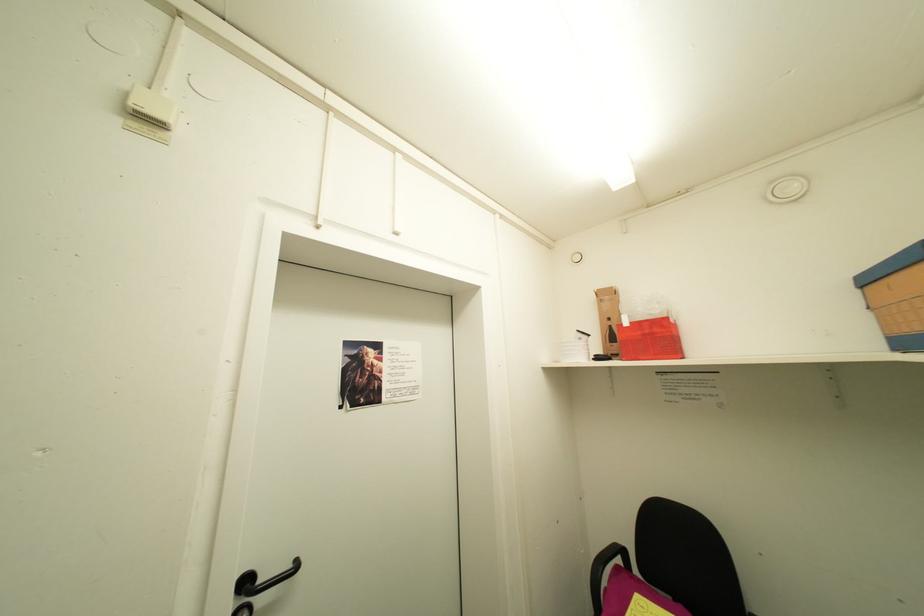
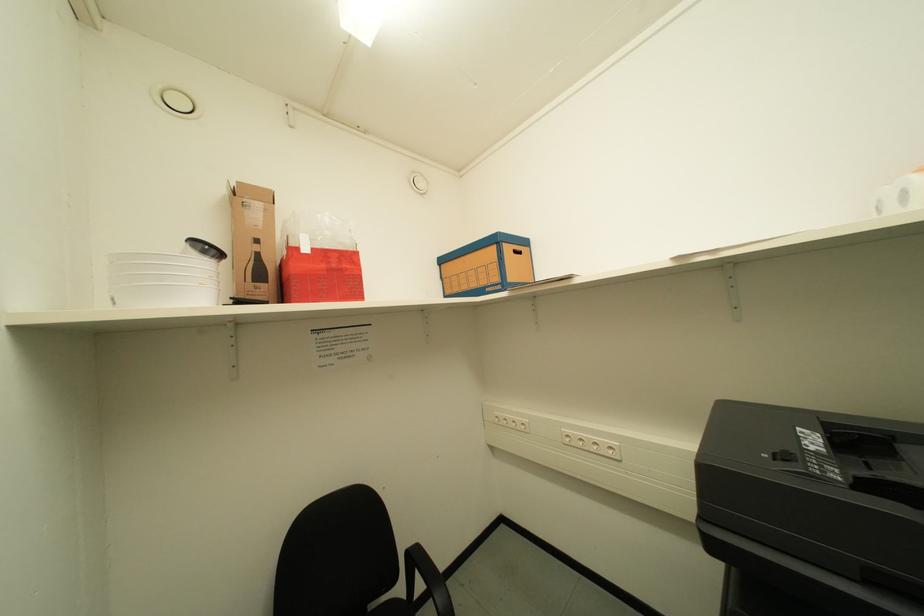
Question: The first image is from the beginning of the video and the second image is from the end. How did the camera likely rotate when shooting the video?

Choices:
 (A) Left
 (B) Right
 (C) Up
 (D) Down

Answer: (B)